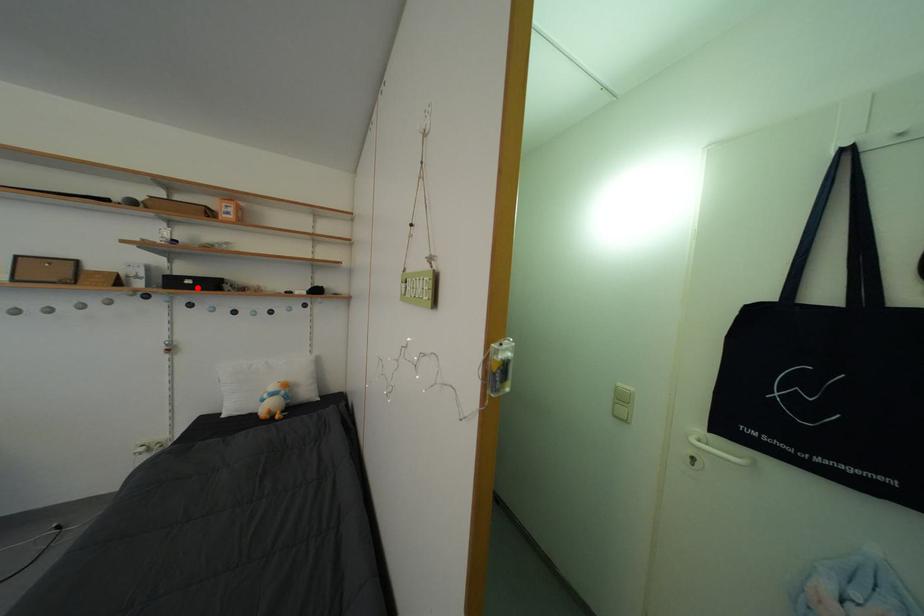
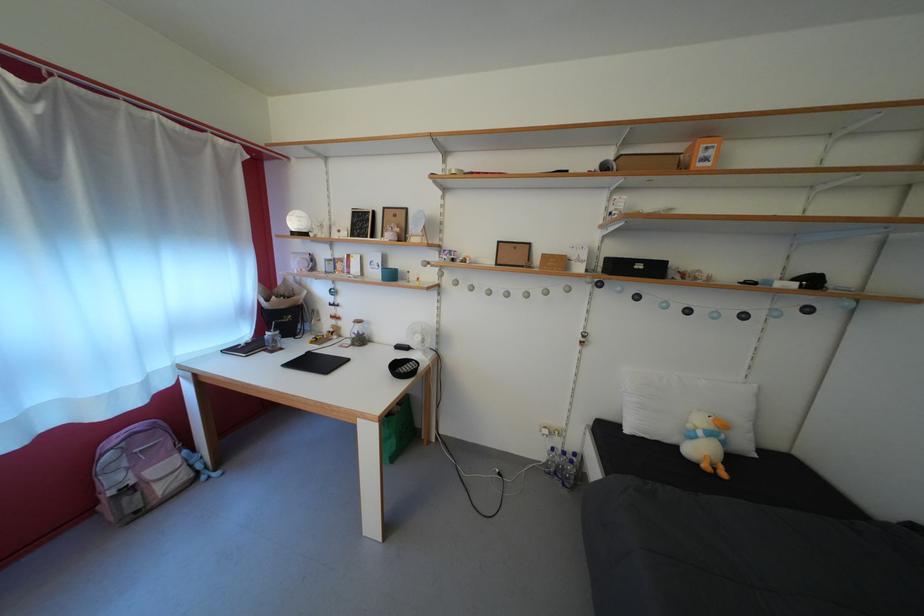
The point at the highlighted location is marked in the first image. Where is the corresponding point in the second image?

(648, 273)